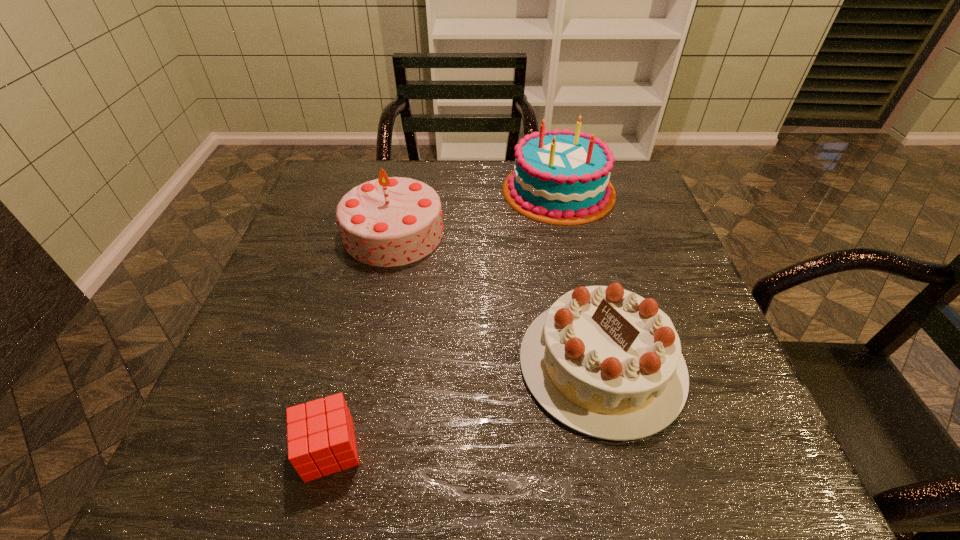
Locate an element on the screen. This screenshot has width=960, height=540. empty space between the second shortest object and the shortest object is located at coordinates (466, 407).

Identify the location of vacant area that lies between the third tallest object and the cube. (466, 407).

This screenshot has height=540, width=960. In order to click on free space that is in between the third tallest object and the cube in this screenshot , I will do `click(466, 407)`.

You are a GUI agent. You are given a task and a screenshot of the screen. Output one action in this format:
    pyautogui.click(x=<x>, y=<y>)
    Task: Click on the blank region between the shortest object and the shortest birthday cake
    This screenshot has width=960, height=540.
    Given the screenshot: What is the action you would take?
    pyautogui.click(x=466, y=407)

Image resolution: width=960 pixels, height=540 pixels. I want to click on object that stands as the third closest to the leftmost birthday cake, so click(321, 441).

The image size is (960, 540). What are the coordinates of `the second closest object relative to the leftmost birthday cake` in the screenshot? It's located at (606, 362).

Find the location of a particular element. birthday cake that can be found as the second closest to the shortest object is located at coordinates (391, 221).

Identify the location of the second closest birthday cake relative to the second shortest object. Image resolution: width=960 pixels, height=540 pixels. (560, 177).

You are a GUI agent. You are given a task and a screenshot of the screen. Output one action in this format:
    pyautogui.click(x=<x>, y=<y>)
    Task: Click on the vacant region that satisfies the following two spatial constraints: 1. on the back side of the shortest object; 2. on the left side of the leftmost birthday cake
    Image resolution: width=960 pixels, height=540 pixels.
    Given the screenshot: What is the action you would take?
    pyautogui.click(x=383, y=233)